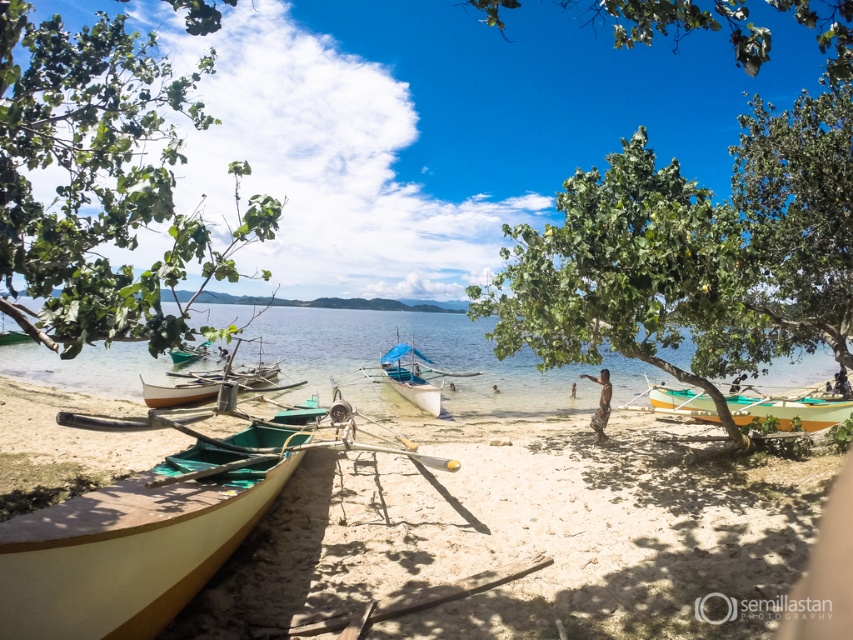
Question: Which of these objects is positioned closest to the yellow polished wood canoe at lower left?

Choices:
 (A) green leafy tree at upper center
 (B) white matte boat at center

Answer: (A)

Question: Does wooden canoe at lower left appear on the left side of clear blue water at center?

Choices:
 (A) yes
 (B) no

Answer: (B)

Question: Does clear blue water at center appear on the left side of green matte boat at lower left?

Choices:
 (A) yes
 (B) no

Answer: (B)

Question: Is green leafy tree at upper center bigger than green matte boat at lower left?

Choices:
 (A) yes
 (B) no

Answer: (A)

Question: Which of the following is the farthest from the observer?

Choices:
 (A) (125, 317)
 (B) (582, 611)
 (C) (840, 417)
 (D) (769, 36)

Answer: (C)

Question: Which of the following is the closest to the observer?

Choices:
 (A) green matte boat at lower left
 (B) white matte boat at center
 (C) clear blue water at center

Answer: (C)